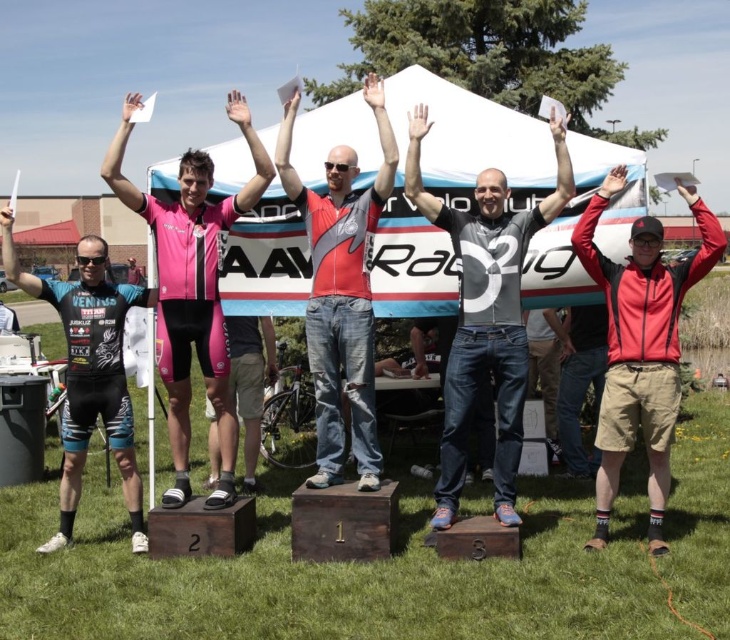
Who is lower down, red matte jacket at center or pink matte cycling suit at center?

red matte jacket at center is lower down.

Who is more distant from viewer, (634, 413) or (131, 202)?

The point (131, 202) is more distant.

Where is `red matte jacket at center`? red matte jacket at center is located at coordinates (639, 346).

Between point (407, 168) and point (695, 211), which one is positioned behind?

Positioned behind is point (407, 168).

What do you see at coordinates (485, 314) in the screenshot?
I see `blue jeans at center` at bounding box center [485, 314].

Which is in front, point (461, 428) or point (637, 273)?

Point (637, 273) is more forward.

The height and width of the screenshot is (640, 730). I want to click on blue jeans at center, so click(x=485, y=314).

The image size is (730, 640). What do you see at coordinates (639, 346) in the screenshot? I see `red matte jacket at center` at bounding box center [639, 346].

Who is positioned more to the right, red matte jacket at center or red matte jersey at center?

From the viewer's perspective, red matte jacket at center appears more on the right side.

Who is more forward, (645, 332) or (342, 220)?

Point (645, 332)

You are a GUI agent. You are given a task and a screenshot of the screen. Output one action in this format:
    pyautogui.click(x=<x>, y=<y>)
    Task: Click on the red matte jacket at center
    
    Given the screenshot: What is the action you would take?
    pyautogui.click(x=639, y=346)